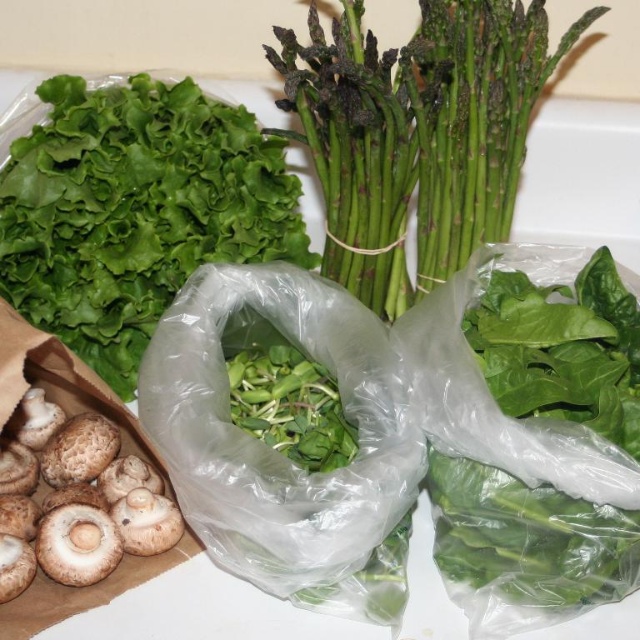
You are arranging vegetables on a counter and notice the green leafy lettuce at upper left and the green matte asparagus at center. Which vegetable is closer to you?

The green leafy lettuce at upper left is closer to you because the green matte asparagus at center is behind it.

You are arranging vegetables on a counter and want to place the green leafy lettuce at upper left and the brown textured mushroom at lower left. Which vegetable has a larger width?

The green leafy lettuce at upper left has a larger width than the brown textured mushroom at lower left.

You are a chef preparing a vegetable platter and need to arrange the green matte asparagus at center and brown textured mushroom at lower left. The platter is 60 centimeters wide. Can both items fit side by side on the platter without overlapping?

The distance between the green matte asparagus at center and brown textured mushroom at lower left is 58.38 centimeters. Since the platter is 60 centimeters wide, there is enough space to place both items side by side without overlapping.